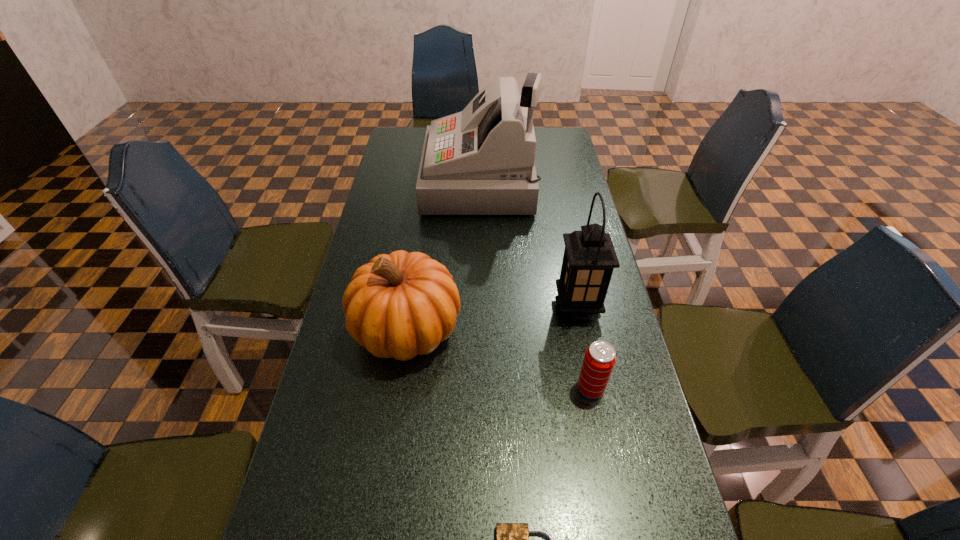
The height and width of the screenshot is (540, 960). I want to click on vacant space located on the back of the soda can, so click(578, 327).

Find the location of a particular element. object that is at the far edge is located at coordinates (481, 161).

You are a GUI agent. You are given a task and a screenshot of the screen. Output one action in this format:
    pyautogui.click(x=<x>, y=<y>)
    Task: Click on the object located in the left edge section of the desktop
    This screenshot has width=960, height=540.
    Given the screenshot: What is the action you would take?
    pyautogui.click(x=403, y=304)

Find the location of `lantern that is at the right edge`. lantern that is at the right edge is located at coordinates (589, 259).

Identify the location of soda can positioned at the right edge. Image resolution: width=960 pixels, height=540 pixels. (599, 360).

The height and width of the screenshot is (540, 960). I want to click on vacant space at the left edge of the desktop, so click(416, 202).

In the image, there is a desktop. Where is `vacant area at the right edge`? The height and width of the screenshot is (540, 960). vacant area at the right edge is located at coordinates (569, 367).

Find the location of a particular element. This screenshot has width=960, height=540. free space between the second shortest object and the farthest object is located at coordinates (536, 285).

The image size is (960, 540). I want to click on free point between the lantern and the pumpkin, so click(x=492, y=318).

This screenshot has height=540, width=960. In order to click on free space between the second shortest object and the second tallest object in this screenshot , I will do `click(584, 347)`.